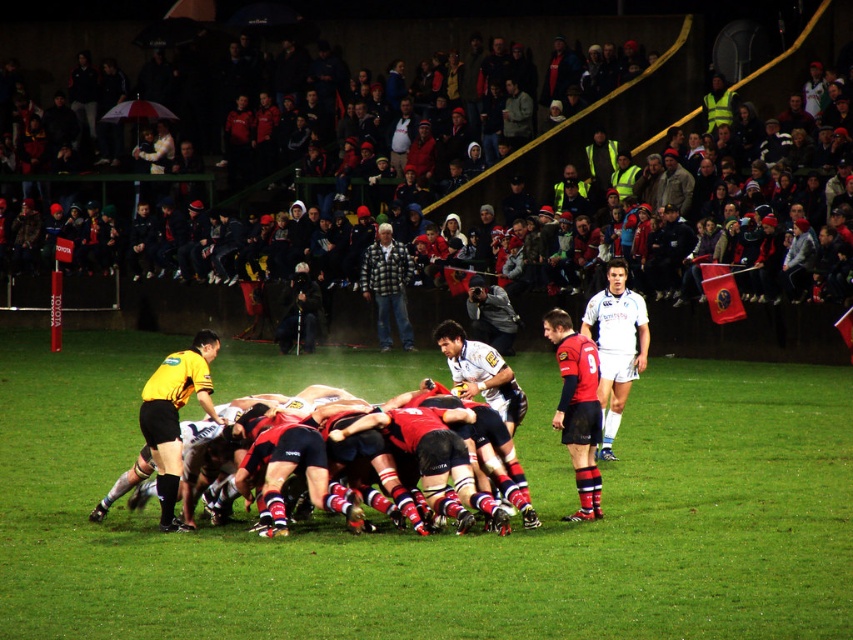
You are a sports analyst watching the rugby match. You notice two items at the center of the field. Which one is thinner between the red matte jersey at center and the plaid jacket at center?

The red matte jersey at center is thinner than the plaid jacket at center.

You are a photographer positioned at the edge of the rugby field. You want to take a photo of the scrum where both the yellow jersey at center and the white jersey at center are clearly visible. Based on their positions, which jersey should you focus on first to ensure both are in frame?

The yellow jersey at center is in front of the white jersey at center, so you should focus on the yellow jersey at center first to ensure both are visible in the photo.